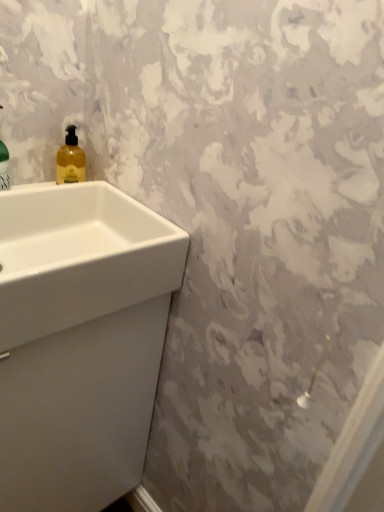
Question: Considering the relative positions of white glossy sink at lower left, the first sink when ordered from bottom to top, and yellow translucent liquid at upper left in the image provided, is white glossy sink at lower left, the first sink when ordered from bottom to top, to the left or to the right of yellow translucent liquid at upper left?

Choices:
 (A) left
 (B) right

Answer: (A)

Question: Does point (x=18, y=366) appear closer or farther from the camera than point (x=62, y=156)?

Choices:
 (A) closer
 (B) farther

Answer: (A)

Question: Which object is the farthest from the white glossy sink at left, acting as the second sink starting from the bottom?

Choices:
 (A) yellow translucent liquid at upper left
 (B) white glossy sink at lower left, the first sink when ordered from bottom to top

Answer: (A)

Question: Estimate the real-world distances between objects in this image. Which object is closer to the yellow translucent liquid at upper left?

Choices:
 (A) white glossy sink at left, acting as the second sink starting from the bottom
 (B) white glossy sink at lower left, the second sink viewed from the top

Answer: (A)